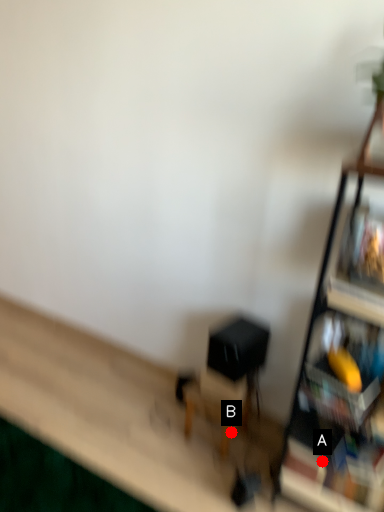
Question: Two points are circled on the image, labeled by A and B beside each circle. Which point is farther from the camera taking this photo?

Choices:
 (A) A is further
 (B) B is further

Answer: (B)